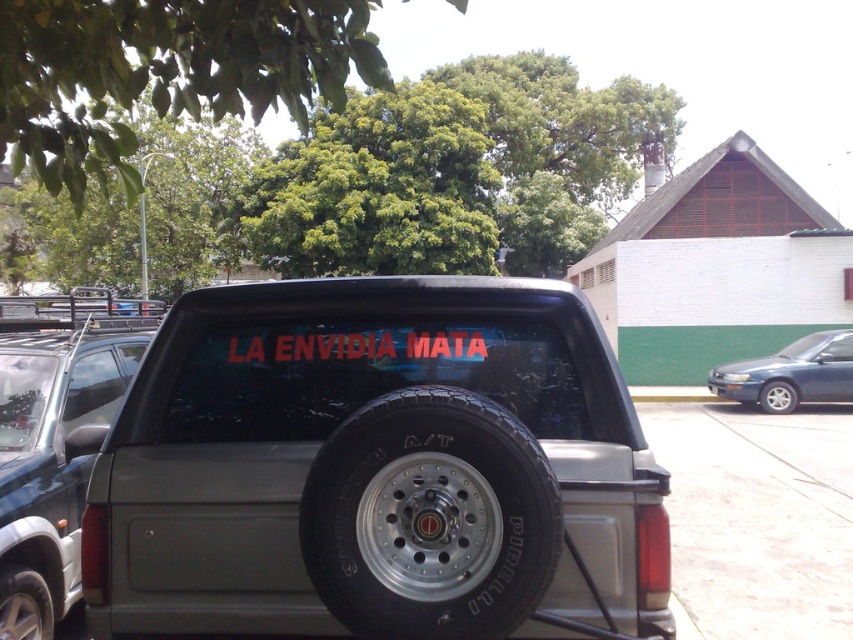
Question: Is metallic gray pickup truck at center closer to camera compared to black matte text at center?

Choices:
 (A) yes
 (B) no

Answer: (A)

Question: Is metallic gray pickup truck at center smaller than black rubber tire at lower center?

Choices:
 (A) no
 (B) yes

Answer: (A)

Question: Which object appears closest to the camera in this image?

Choices:
 (A) black rubber tire at lower right
 (B) metallic blue sedan at right
 (C) black rubber tire at lower center
 (D) satin silver suv at center

Answer: (C)

Question: Does black rubber tire at lower center have a greater width compared to black rubber tire at lower right?

Choices:
 (A) no
 (B) yes

Answer: (A)

Question: Among these objects, which one is farthest from the camera?

Choices:
 (A) black rubber tire at lower left
 (B) black rubber tire at lower right

Answer: (B)

Question: Which of the following is the farthest from the observer?

Choices:
 (A) black rubber tire at lower left
 (B) black rubber tire at center
 (C) metallic blue sedan at right

Answer: (C)